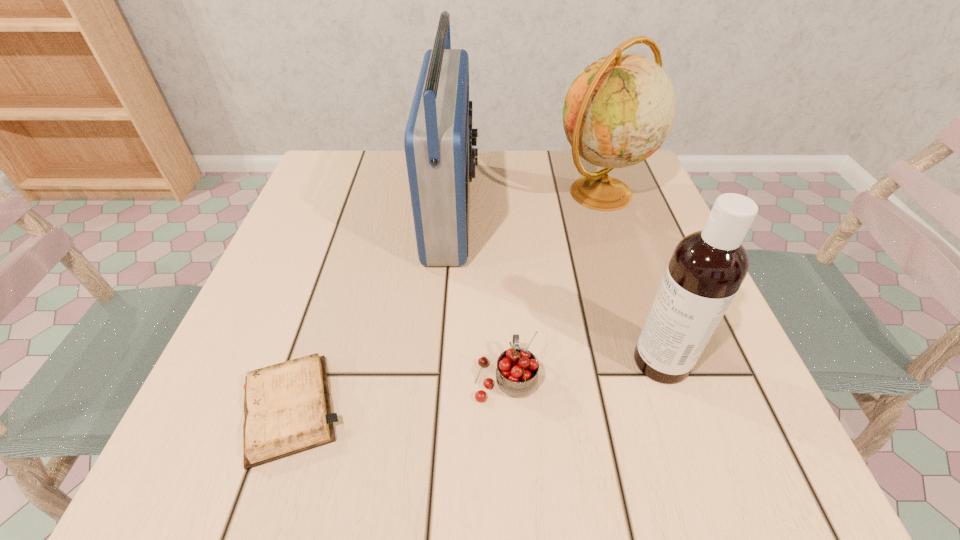
Locate an element on the screen. The height and width of the screenshot is (540, 960). vacant space that is in between the cherry and the dishwasher detergent is located at coordinates (584, 369).

Locate an element on the screen. The width and height of the screenshot is (960, 540). vacant space in between the radio receiver and the dishwasher detergent is located at coordinates (557, 285).

Image resolution: width=960 pixels, height=540 pixels. I want to click on free spot between the globe and the shortest object, so click(444, 301).

Find the location of a particular element. Image resolution: width=960 pixels, height=540 pixels. empty space that is in between the cherry and the dishwasher detergent is located at coordinates (584, 369).

This screenshot has width=960, height=540. In order to click on vacant region between the leftmost object and the cherry in this screenshot , I will do coord(397,393).

This screenshot has height=540, width=960. Identify the location of free space between the fourth tallest object and the dishwasher detergent. (584, 369).

The width and height of the screenshot is (960, 540). I want to click on empty space that is in between the fourth tallest object and the radio receiver, so click(479, 293).

This screenshot has width=960, height=540. What are the coordinates of `vacant area between the radio receiver and the leftmost object` in the screenshot? It's located at (372, 309).

Find the location of a particular element. The image size is (960, 540). free spot between the second shortest object and the dishwasher detergent is located at coordinates (584, 369).

I want to click on object that stands as the third closest to the shortest object, so click(707, 267).